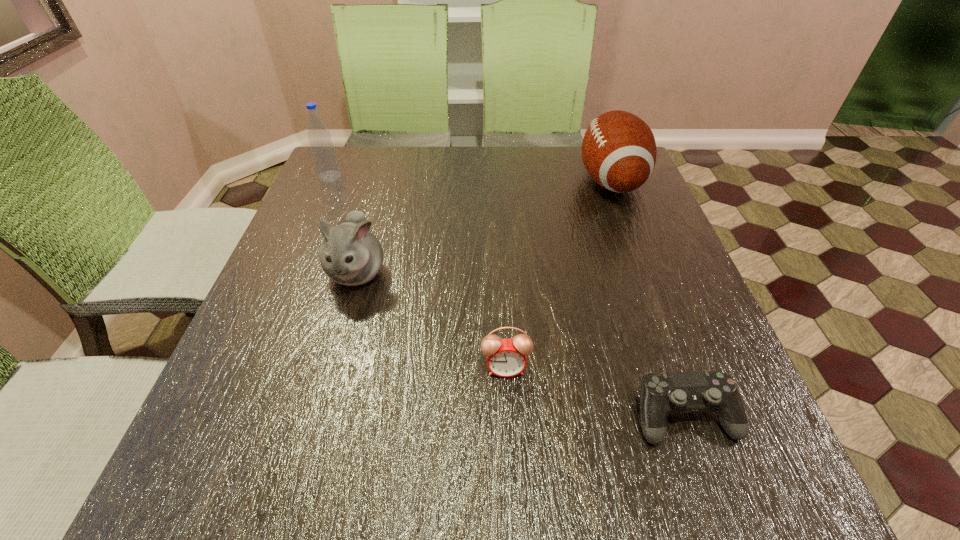
I want to click on free space between the hamster and the football, so click(x=484, y=227).

I want to click on free space between the second shortest object and the football, so click(558, 275).

Identify the location of free point between the third object from right to left and the hamster. Image resolution: width=960 pixels, height=540 pixels. (431, 320).

You are a GUI agent. You are given a task and a screenshot of the screen. Output one action in this format:
    pyautogui.click(x=<x>, y=<y>)
    Task: Click on the free space between the football and the third nearest object
    
    Given the screenshot: What is the action you would take?
    484,227

Where is `free space between the control and the leftmost object`? The image size is (960, 540). free space between the control and the leftmost object is located at coordinates (507, 296).

This screenshot has height=540, width=960. Identify the location of the closest object relative to the football. (506, 357).

At what (x,y) coordinates should I click in order to perform the action: click on the fourth closest object to the third nearest object. Please return your answer as a coordinate pair (x, y). Image resolution: width=960 pixels, height=540 pixels. Looking at the image, I should click on (661, 394).

Where is `vacant region that satisfies the following two spatial constraints: 1. on the laces of the football; 2. on the clock face of the fourth farthest object`? The image size is (960, 540). vacant region that satisfies the following two spatial constraints: 1. on the laces of the football; 2. on the clock face of the fourth farthest object is located at coordinates tap(682, 368).

The height and width of the screenshot is (540, 960). Identify the location of free location that satisfies the following two spatial constraints: 1. on the clock face of the second shortest object; 2. on the left side of the control. (508, 415).